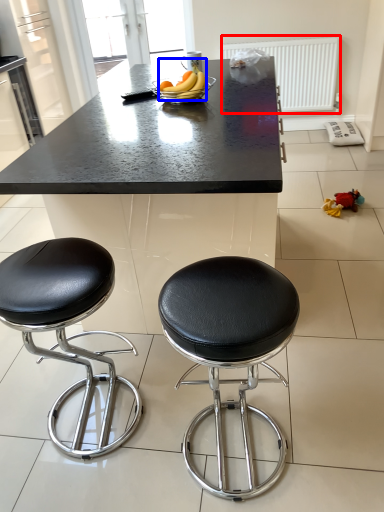
Question: Which point is closer to the camera, radiator (highlighted by a red box) or banana (highlighted by a blue box)?

Choices:
 (A) radiator
 (B) banana

Answer: (B)